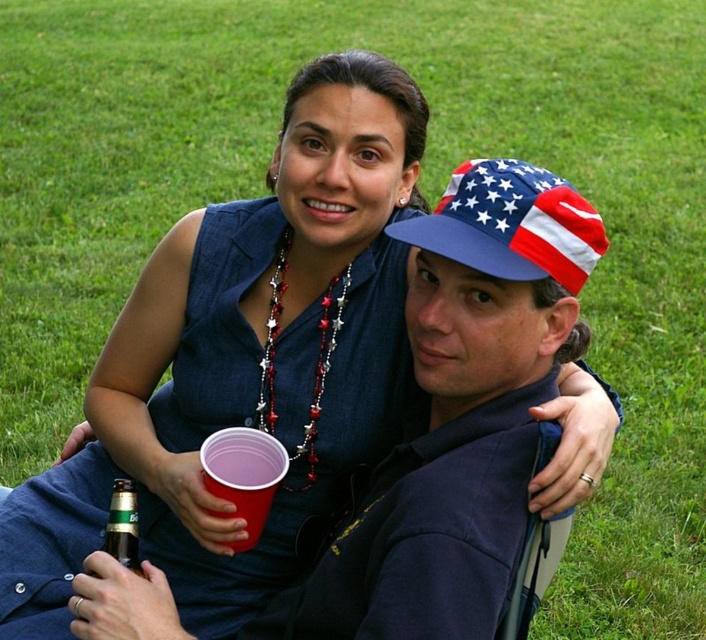
What do you see at coordinates (510, 225) in the screenshot? The height and width of the screenshot is (640, 706). I see `american flag fabric cap at upper right` at bounding box center [510, 225].

From the picture: Who is more forward, (527, 179) or (109, 532)?

Positioned in front is point (527, 179).

Where is `american flag fabric cap at upper right`? The width and height of the screenshot is (706, 640). american flag fabric cap at upper right is located at coordinates (510, 225).

At what (x,y) coordinates should I click in order to perform the action: click on american flag fabric cap at upper right. Please return your answer as a coordinate pair (x, y). This screenshot has width=706, height=640. Looking at the image, I should click on (510, 225).